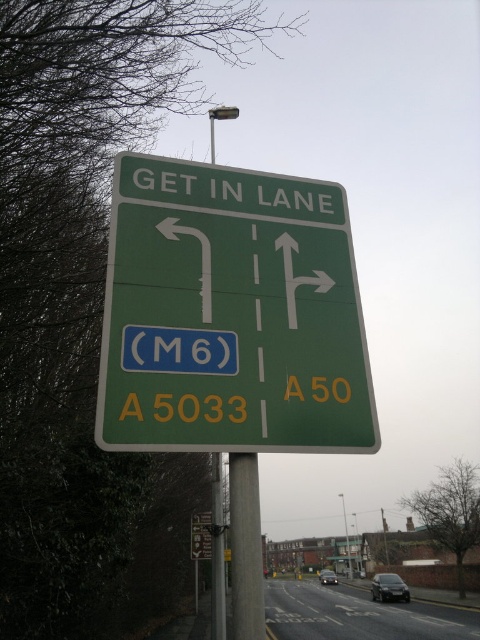
You are a driver approaching the road sign and need to determine which of the two points, point (119, 435) or point (214, 492), is closer to your position. Based on the sign, which point should you focus on first?

Point (119, 435) is closer to the viewer than point (214, 492), so you should focus on point (119, 435) first.

Based on the photo, you are driving and see the road sign. Can you determine if the green matte sign at center is attached to the metallic pole at center?

The green matte sign at center is above the metallic pole at center, so it is likely attached to it.